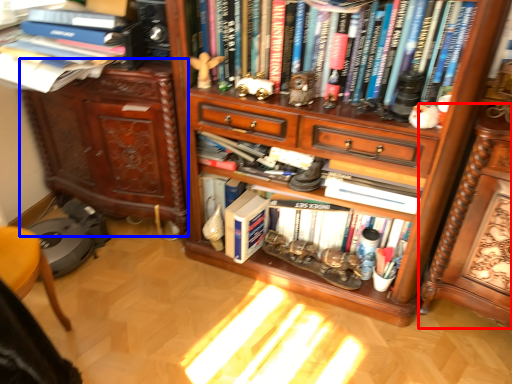
Question: Among these objects, which one is farthest to the camera, computer desk (highlighted by a red box) or cabinetry (highlighted by a blue box)?

Choices:
 (A) computer desk
 (B) cabinetry

Answer: (B)